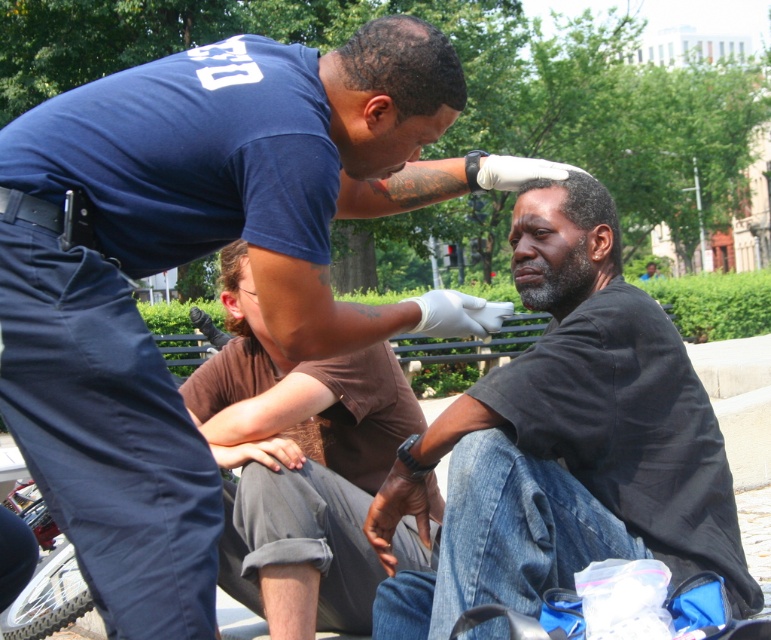
Question: Considering the real-world distances, which object is farthest from the black matte shirt at center?

Choices:
 (A) blue uniform shirt at upper left
 (B) brown cotton shirt at center

Answer: (A)

Question: Based on their relative distances, which object is farther from the blue uniform shirt at upper left?

Choices:
 (A) black matte shirt at center
 (B) brown cotton shirt at center

Answer: (B)

Question: Which of the following is the closest to the observer?

Choices:
 (A) (325, 404)
 (B) (443, 413)

Answer: (B)

Question: Can you confirm if blue uniform shirt at upper left is thinner than black matte shirt at center?

Choices:
 (A) no
 (B) yes

Answer: (A)

Question: Can you confirm if blue uniform shirt at upper left is thinner than black matte shirt at center?

Choices:
 (A) no
 (B) yes

Answer: (A)

Question: Does black matte shirt at center appear on the left side of brown cotton shirt at center?

Choices:
 (A) no
 (B) yes

Answer: (A)